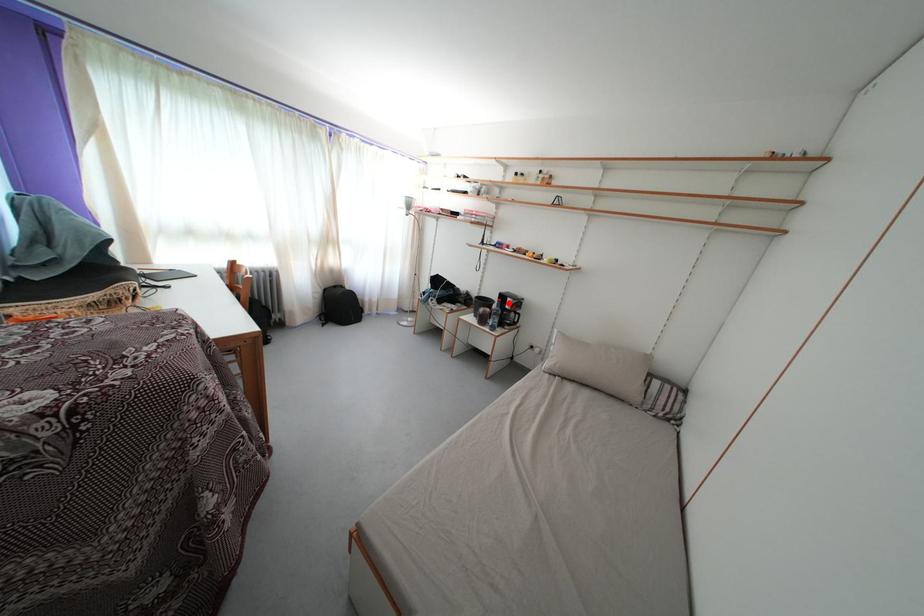
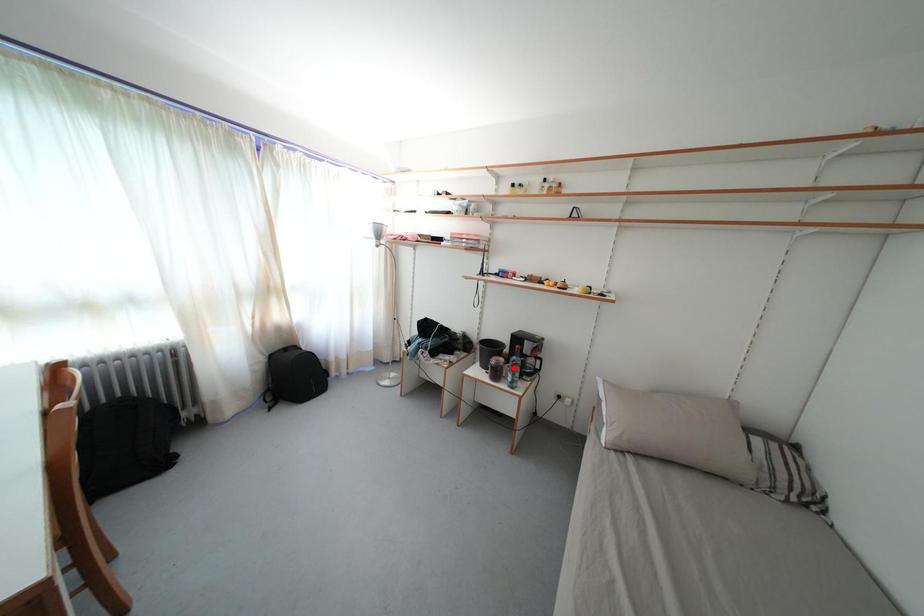
I am providing you with two images of the same scene from different viewpoints. A red point is marked on the first image and another point is marked on the second image. Do the highlighted points in image1 and image2 indicate the same real-world spot?

No